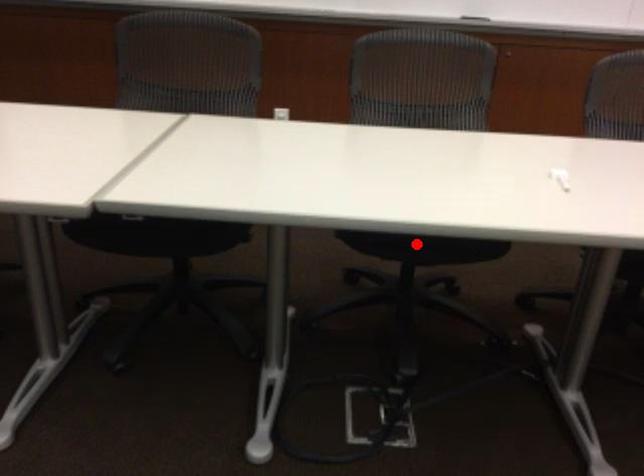
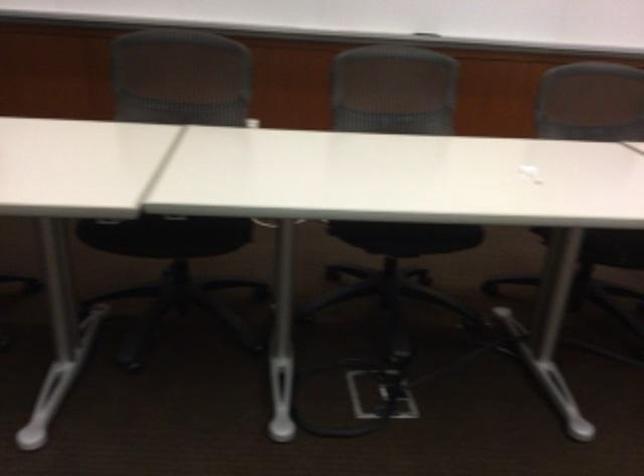
Question: I am providing you with two images of the same scene from different viewpoints. Given a red point in image1, look at the same physical point in image2. Is it:

Choices:
 (A) Closer to the viewpoint
 (B) Farther from the viewpoint

Answer: (B)